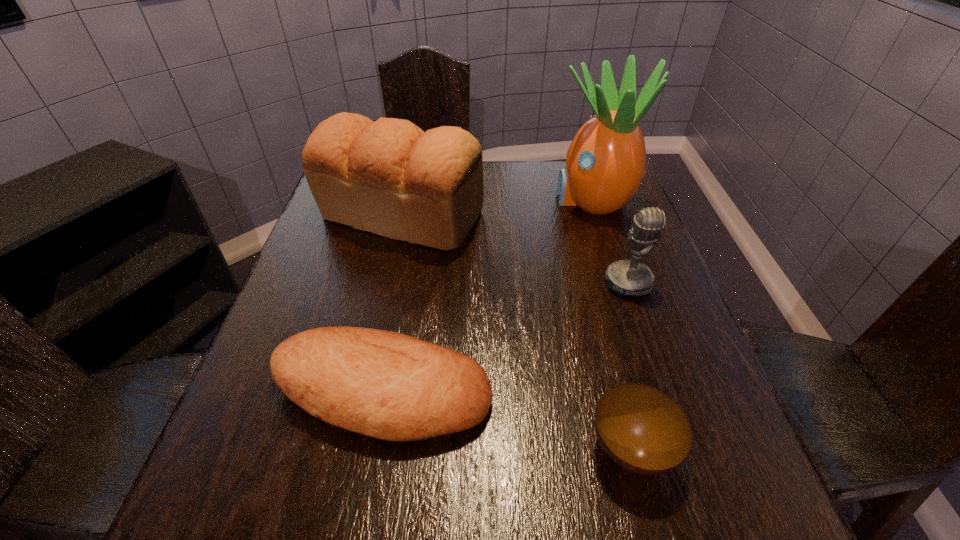
Locate an element on the screen. The image size is (960, 540). free space located 0.080m at the entrance of the pineapple is located at coordinates (522, 199).

Find the location of a particular element. free spot located on the back of the fourth shortest object is located at coordinates (412, 168).

You are a GUI agent. You are given a task and a screenshot of the screen. Output one action in this format:
    pyautogui.click(x=<x>, y=<y>)
    Task: Click on the vacant region located 0.130m on the front-facing side of the microphone
    The image size is (960, 540).
    Given the screenshot: What is the action you would take?
    pyautogui.click(x=651, y=349)

Locate an element on the screen. This screenshot has width=960, height=540. vacant space situated 0.370m on the back of the nearer bread is located at coordinates (412, 229).

Where is `vacant space located 0.050m on the right of the shortest object`? vacant space located 0.050m on the right of the shortest object is located at coordinates (705, 448).

This screenshot has width=960, height=540. In order to click on pineapple that is at the far edge in this screenshot , I will do `click(606, 162)`.

Locate an element on the screen. This screenshot has height=540, width=960. bread situated at the far edge is located at coordinates tap(389, 177).

Locate an element on the screen. object that is at the near edge is located at coordinates (641, 429).

Locate an element on the screen. This screenshot has width=960, height=540. pineapple present at the right edge is located at coordinates (606, 162).

Where is `microphone that is at the right edge`? microphone that is at the right edge is located at coordinates (624, 277).